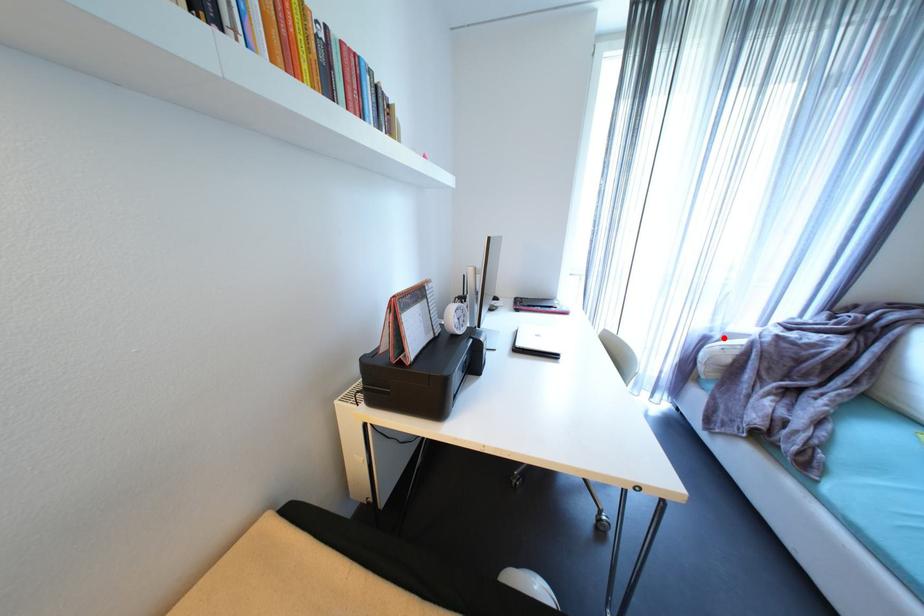
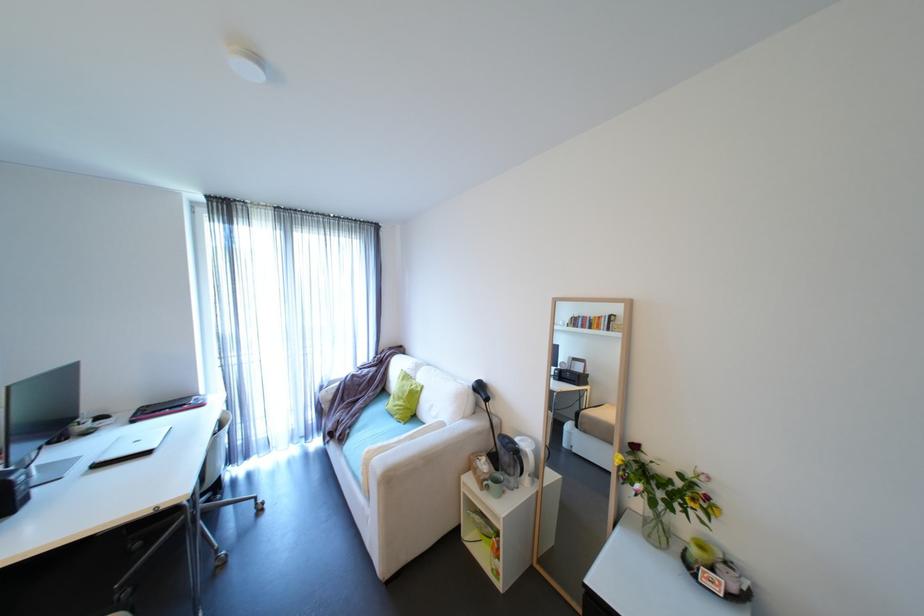
The point at the highlighted location is marked in the first image. Where is the corresponding point in the second image?

(333, 386)